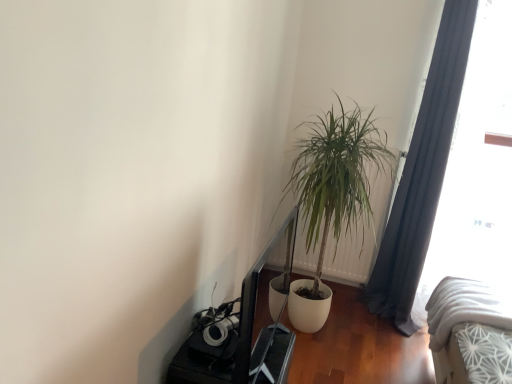
Locate an element on the screen. This screenshot has width=512, height=384. free space that is in between green leafy plant at center and dark gray fabric curtain at right is located at coordinates (390, 337).